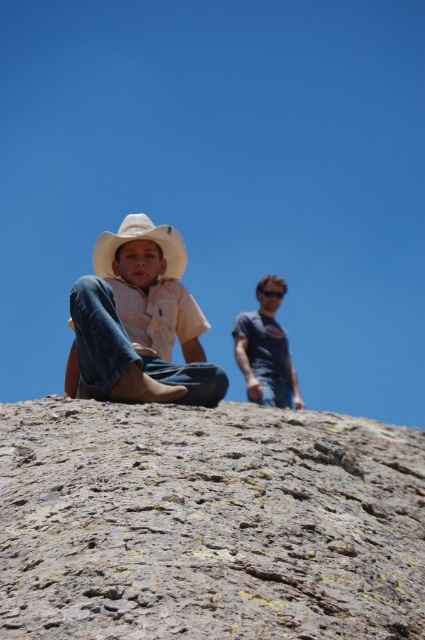
You are standing at the point marked as point (207,524) in the image. What is the surface you are standing on?

The surface you are standing on is a rusty stone rock at center.